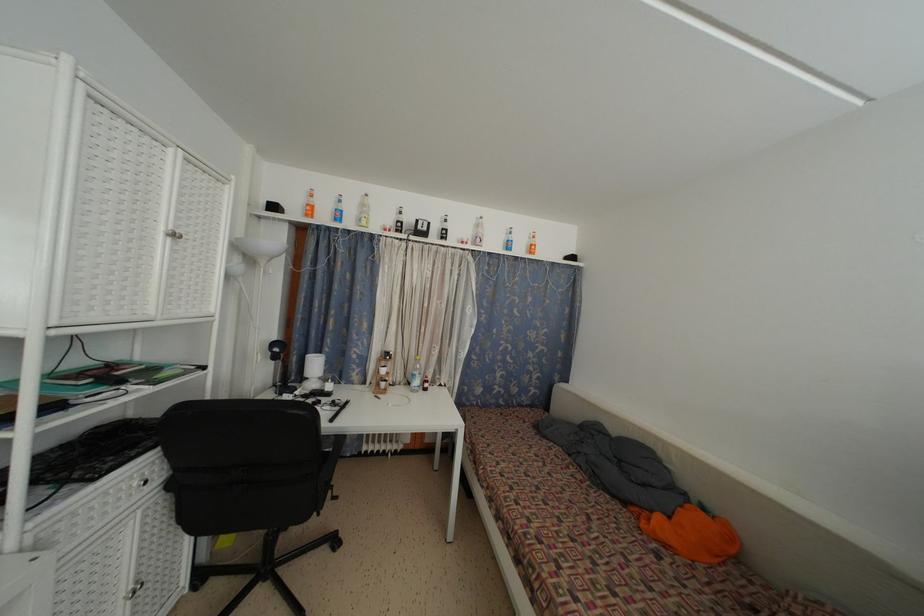
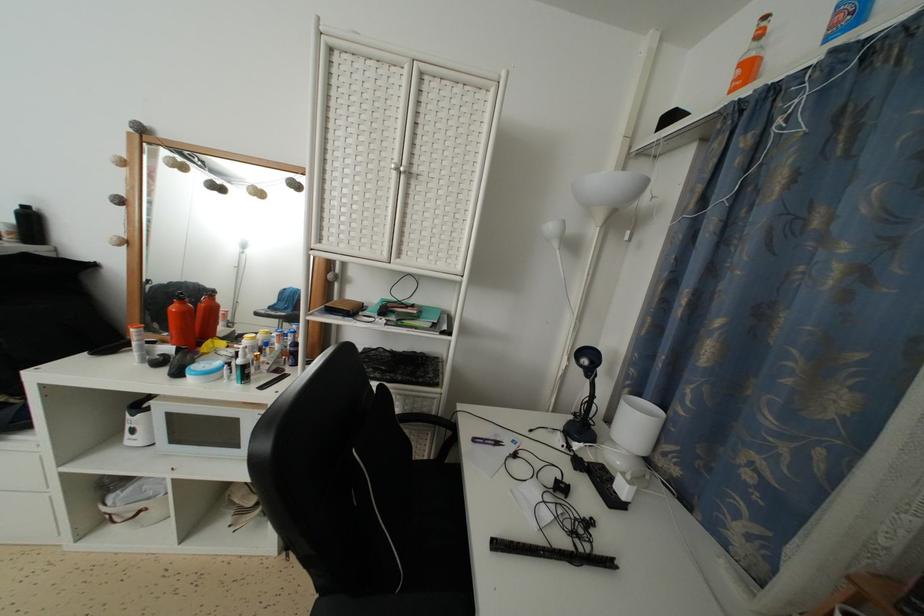
In the second image, find the point that corresponds to [351,408] in the first image.

(614, 569)